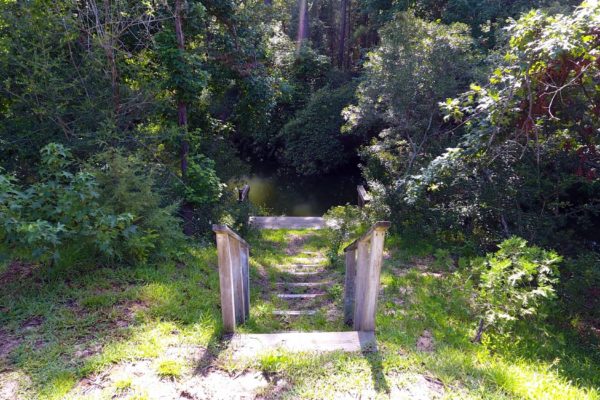
Find the location of a particular element. 1 right side of railing is located at coordinates (360, 297).